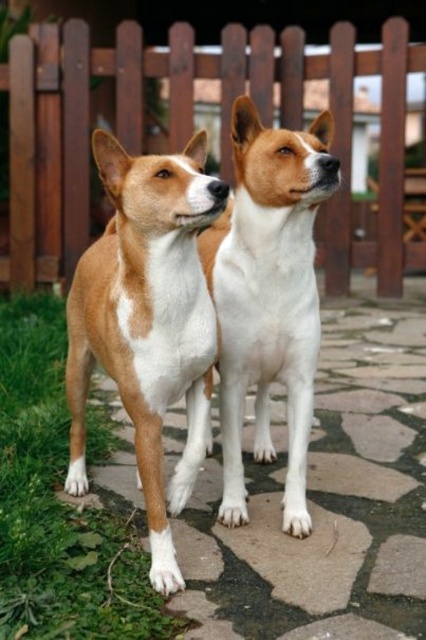
You are standing in the garden where the two dogs are located. You want to take a photo of the wooden fence at upper center. Which direction should you face to capture it in your view?

You should face the upper center direction to capture the wooden fence at upper center in your view.

You are a photographer trying to capture a photo of the white fur dog at center. You notice there is a wooden fence at upper center in the background. From the dog owner standing in front of the dog, which side of the dog should you avoid standing on to prevent the fence from blocking the shot?

You should avoid standing on the left side of the white fur dog at center because the wooden fence at upper center is positioned on the left side of the white fur dog at center, which would block the shot if you stand there.